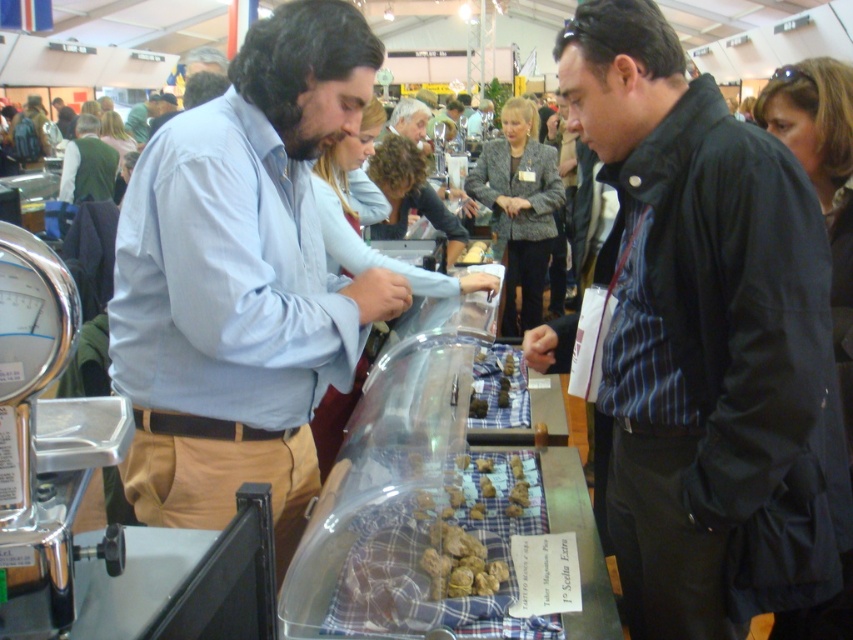
You are a vendor at the market and need to hand a sample to the customer. The customer is the person wearing the light blue shirt at center. Which direction should you walk to reach them from the black striped shirt at center?

The black striped shirt at center is to the right of the light blue shirt at center, so you should walk to the left to reach the light blue shirt at center.

You are a photographer at the market and want to capture both the black striped shirt at center and the light blue shirt at center in a single photo. Which shirt should you focus on first to ensure both are in frame?

The black striped shirt at center is taller than the light blue shirt at center, so you should focus on the black striped shirt at center first to ensure both are in frame.

You are standing in the market and want to locate the black striped shirt at center. According to the coordinates provided, where would you look relative to the image frame?

The black striped shirt at center is located at the 2D coordinates point 0.537 on the x axis and 0.830 on the y axis relative to the image frame.